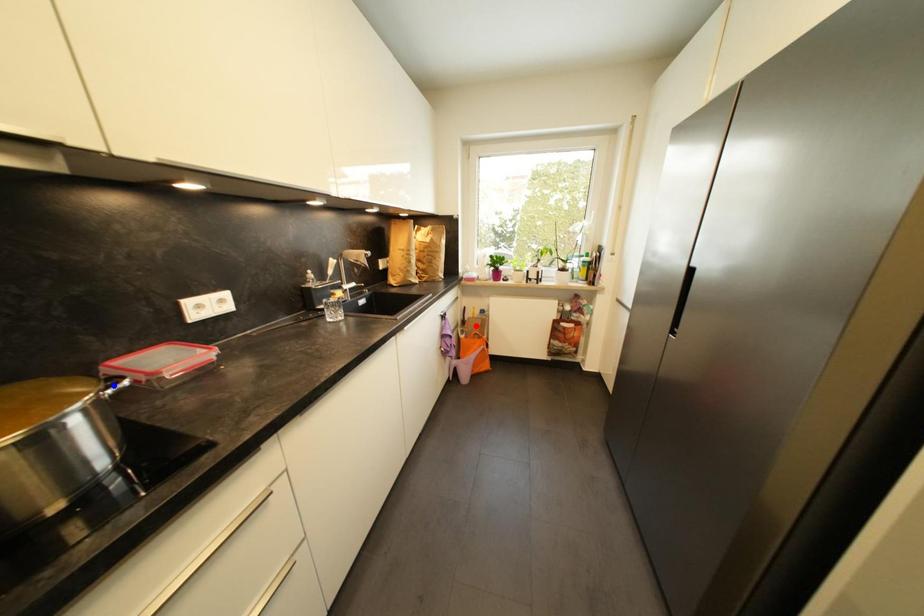
Question: Which of the two points in the image is closer to the camera?

Choices:
 (A) Blue point is closer.
 (B) Red point is closer.

Answer: (A)